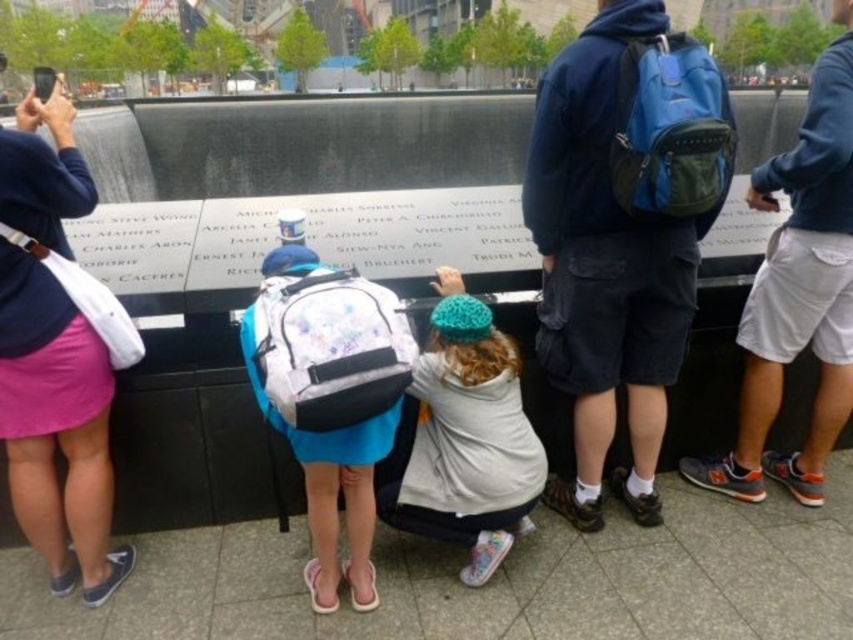
You are a photographer taking a picture of the memorial wall. You notice the blue fabric backpack at center and the pink fabric skirt at left in your frame. Which object should you adjust to avoid blocking the view of the wall since it is taller?

The blue fabric backpack at center is much taller than the pink fabric skirt at left, so you should adjust the blue fabric backpack at center to avoid blocking the view of the wall.

Looking at this image, you are a photographer trying to capture a closeup of the blue fabric backpack at center. According to the coordinates provided, where exactly should you focus your camera lens to ensure the backpack is centered in your shot?

The blue fabric backpack at center is located at coordinates point (622, 232), so you should focus your camera lens at that exact point to center the backpack in your shot.

What is located at the coordinates point (56, 426)?

The pink fabric skirt at left is located at point (56, 426).